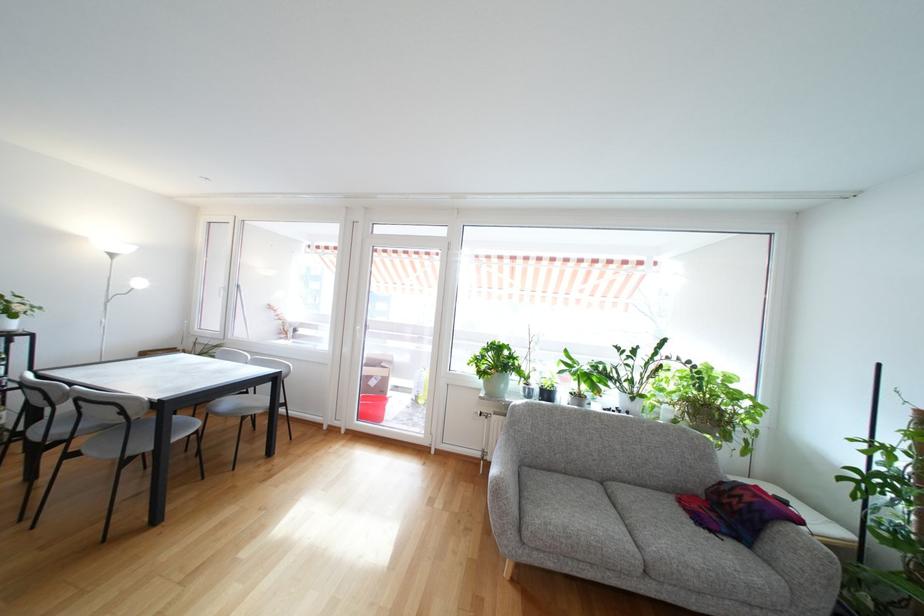
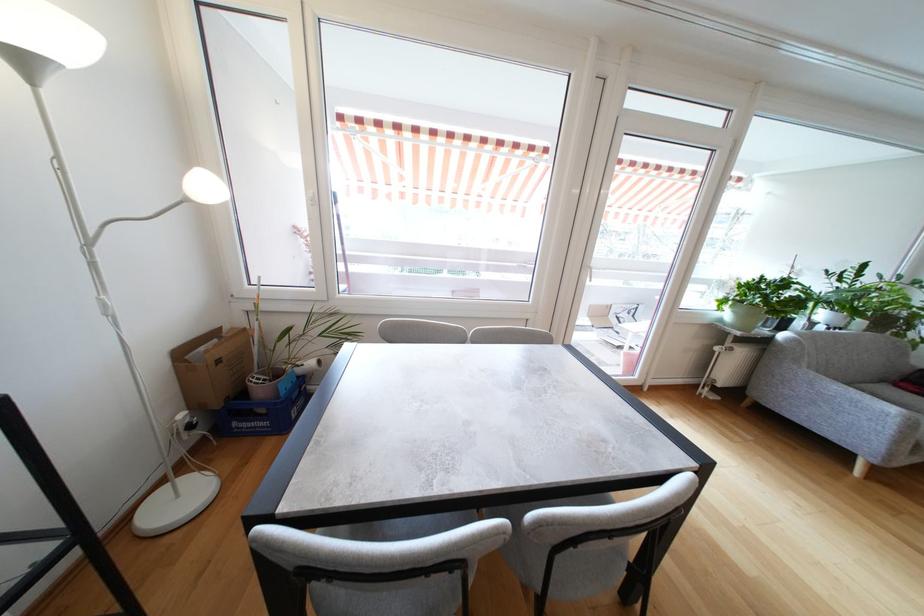
What movement of the cameraman would produce the second image?

The cameraman walked toward left, forward.